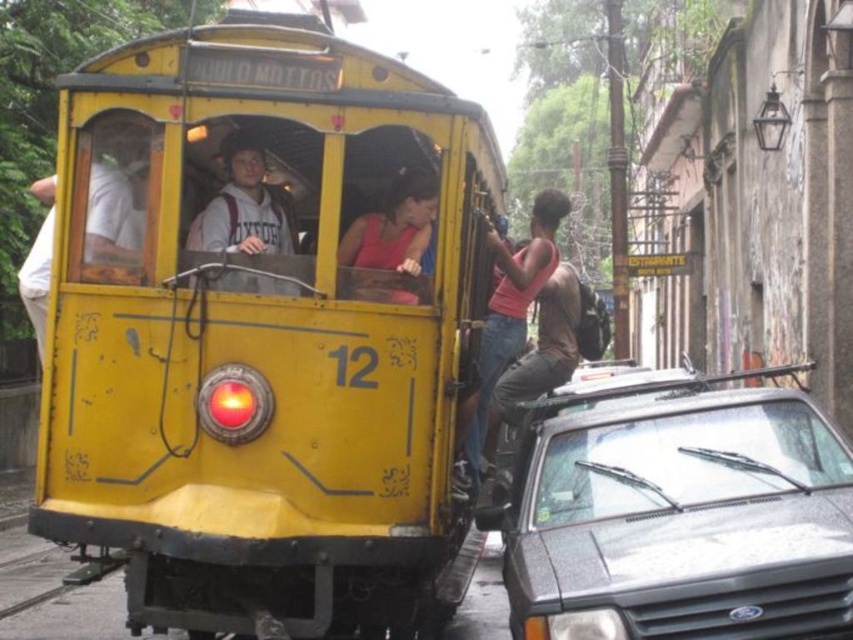
Question: Which object is positioned closest to the matte gray hoodie at center?

Choices:
 (A) yellow matte school bus at center
 (B) matte pink tank top at center

Answer: (B)

Question: Considering the relative positions of black matte car at lower right and pink fabric tank top at upper right in the image provided, where is black matte car at lower right located with respect to pink fabric tank top at upper right?

Choices:
 (A) right
 (B) left

Answer: (A)

Question: Which of the following is the closest to the observer?

Choices:
 (A) (x=544, y=237)
 (B) (x=397, y=212)

Answer: (B)

Question: Observing the image, what is the correct spatial positioning of pink fabric tank top at upper right in reference to matte gray hoodie at center?

Choices:
 (A) above
 (B) below

Answer: (B)

Question: Which object is positioned farthest from the matte gray hoodie at center?

Choices:
 (A) pink fabric tank top at upper right
 (B) yellow matte school bus at center

Answer: (A)

Question: Does yellow matte school bus at center have a greater width compared to matte pink tank top at center?

Choices:
 (A) no
 (B) yes

Answer: (B)